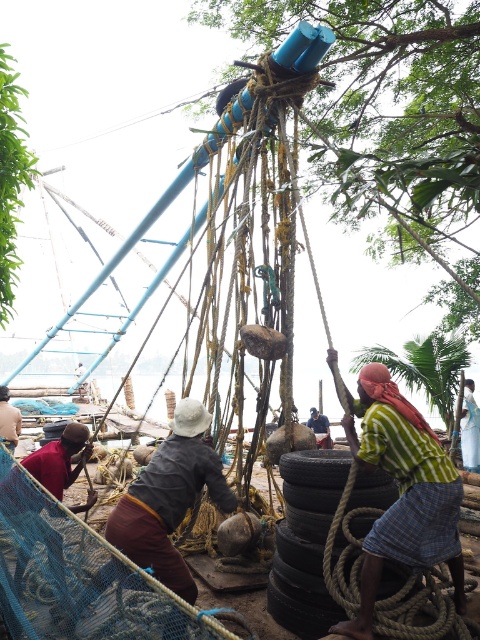
Question: Is red fabric at lower left to the left of dark blue shirt at center from the viewer's perspective?

Choices:
 (A) yes
 (B) no

Answer: (A)

Question: Observing the image, what is the correct spatial positioning of brown fabric hat at center in reference to dark blue shirt at center?

Choices:
 (A) below
 (B) above

Answer: (B)

Question: In this image, where is striped cotton shirt at center located relative to striped fabric shirt at lower right?

Choices:
 (A) below
 (B) above

Answer: (B)

Question: Estimate the real-world distances between objects in this image. Which object is farther from the dark blue shirt at center?

Choices:
 (A) striped fabric shirt at lower right
 (B) brown fabric hat at center

Answer: (B)

Question: Considering the real-world distances, which object is closest to the striped cotton shirt at center?

Choices:
 (A) dark blue shirt at center
 (B) red fabric at lower left

Answer: (B)

Question: Which object is farther from the camera taking this photo?

Choices:
 (A) red fabric at lower left
 (B) brown fabric hat at center
 (C) striped fabric shirt at lower right

Answer: (C)